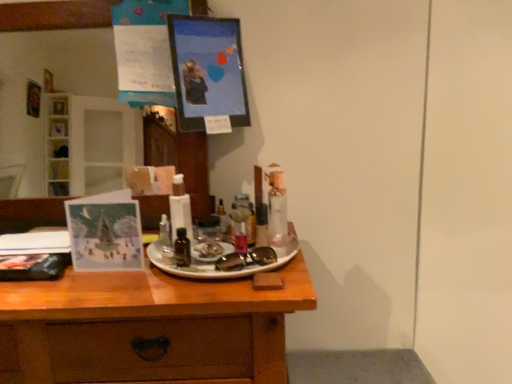
Where is `space that is in front of black glass bottle at center, the 3th toiletry from the right`? The height and width of the screenshot is (384, 512). space that is in front of black glass bottle at center, the 3th toiletry from the right is located at coordinates (185, 284).